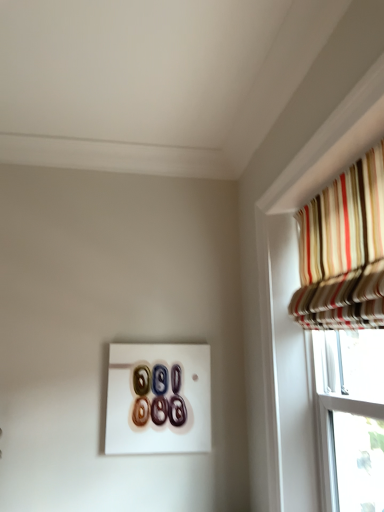
Locate an element on the screen. glossy ceramic buttons at center is located at coordinates tap(158, 399).

The height and width of the screenshot is (512, 384). What do you see at coordinates (158, 399) in the screenshot? I see `glossy ceramic buttons at center` at bounding box center [158, 399].

The height and width of the screenshot is (512, 384). In order to click on striped fabric curtain at upper right in this screenshot , I will do `click(343, 250)`.

The image size is (384, 512). What do you see at coordinates (343, 250) in the screenshot? I see `striped fabric curtain at upper right` at bounding box center [343, 250].

You are a GUI agent. You are given a task and a screenshot of the screen. Output one action in this format:
    pyautogui.click(x=<x>, y=<y>)
    Task: Click on the glossy ceramic buttons at center
    This screenshot has height=512, width=384.
    Given the screenshot: What is the action you would take?
    pyautogui.click(x=158, y=399)

Is striped fabric curtain at upper right at the right side of glossy ceramic buttons at center?

Correct, you'll find striped fabric curtain at upper right to the right of glossy ceramic buttons at center.

Is striped fabric curtain at upper right in front of or behind glossy ceramic buttons at center in the image?

Clearly, striped fabric curtain at upper right is in front of glossy ceramic buttons at center.

Is point (364, 322) positioned behind point (120, 435)?

No, it is not.

From the image's perspective, which one is positioned higher, striped fabric curtain at upper right or glossy ceramic buttons at center?

From the image's view, striped fabric curtain at upper right is above.

Looking at this image, from a real-world perspective, relative to glossy ceramic buttons at center, is striped fabric curtain at upper right vertically above or below?

In terms of real-world spatial position, striped fabric curtain at upper right is above glossy ceramic buttons at center.

Looking at their sizes, would you say striped fabric curtain at upper right is wider or thinner than glossy ceramic buttons at center?

striped fabric curtain at upper right is wider than glossy ceramic buttons at center.

Considering the sizes of striped fabric curtain at upper right and glossy ceramic buttons at center in the image, is striped fabric curtain at upper right taller or shorter than glossy ceramic buttons at center?

Clearly, striped fabric curtain at upper right is taller compared to glossy ceramic buttons at center.

Looking at the image, does striped fabric curtain at upper right seem bigger or smaller compared to glossy ceramic buttons at center?

Clearly, striped fabric curtain at upper right is larger in size than glossy ceramic buttons at center.

Would you say striped fabric curtain at upper right is outside glossy ceramic buttons at center?

Absolutely, striped fabric curtain at upper right is external to glossy ceramic buttons at center.

Would you consider striped fabric curtain at upper right to be distant from glossy ceramic buttons at center?

striped fabric curtain at upper right is far away from glossy ceramic buttons at center.

Is striped fabric curtain at upper right looking in the opposite direction of glossy ceramic buttons at center?

striped fabric curtain at upper right is not turned away from glossy ceramic buttons at center.

The image size is (384, 512). Find the location of `curtain on the right of the glossy ceramic buttons at center`. curtain on the right of the glossy ceramic buttons at center is located at coordinates (343, 250).

Which object is positioned more to the right, glossy ceramic buttons at center or striped fabric curtain at upper right?

striped fabric curtain at upper right is more to the right.

Considering the relative positions of glossy ceramic buttons at center and striped fabric curtain at upper right in the image provided, is glossy ceramic buttons at center in front of striped fabric curtain at upper right?

No, it is behind striped fabric curtain at upper right.

Is point (159, 388) farther from viewer compared to point (351, 301)?

Yes, point (159, 388) is behind point (351, 301).

From the image's perspective, is glossy ceramic buttons at center under striped fabric curtain at upper right?

Yes, from the image's perspective, glossy ceramic buttons at center is below striped fabric curtain at upper right.

From a real-world perspective, relative to striped fabric curtain at upper right, is glossy ceramic buttons at center vertically above or below?

From a real-world perspective, glossy ceramic buttons at center is physically below striped fabric curtain at upper right.

Which of these two, glossy ceramic buttons at center or striped fabric curtain at upper right, is thinner?

glossy ceramic buttons at center.

Which of these two, glossy ceramic buttons at center or striped fabric curtain at upper right, stands shorter?

With less height is glossy ceramic buttons at center.

Does glossy ceramic buttons at center have a larger size compared to striped fabric curtain at upper right?

No.

Would you say glossy ceramic buttons at center is inside or outside striped fabric curtain at upper right?

glossy ceramic buttons at center exists outside the volume of striped fabric curtain at upper right.

Is there a large distance between glossy ceramic buttons at center and striped fabric curtain at upper right?

Yes, glossy ceramic buttons at center is far from striped fabric curtain at upper right.

Is glossy ceramic buttons at center aimed at striped fabric curtain at upper right?

Yes, glossy ceramic buttons at center is oriented towards striped fabric curtain at upper right.

Measure the distance from glossy ceramic buttons at center to striped fabric curtain at upper right.

glossy ceramic buttons at center and striped fabric curtain at upper right are 1.11 meters apart from each other.

Locate an element on the screen. button below the striped fabric curtain at upper right (from the image's perspective) is located at coordinates (158, 399).

In the image, there is a striped fabric curtain at upper right. What are the coordinates of `button below it (from a real-world perspective)` in the screenshot? It's located at (158, 399).

At what (x,y) coordinates should I click in order to perform the action: click on button below the striped fabric curtain at upper right (from the image's perspective). Please return your answer as a coordinate pair (x, y). Image resolution: width=384 pixels, height=512 pixels. Looking at the image, I should click on (158, 399).